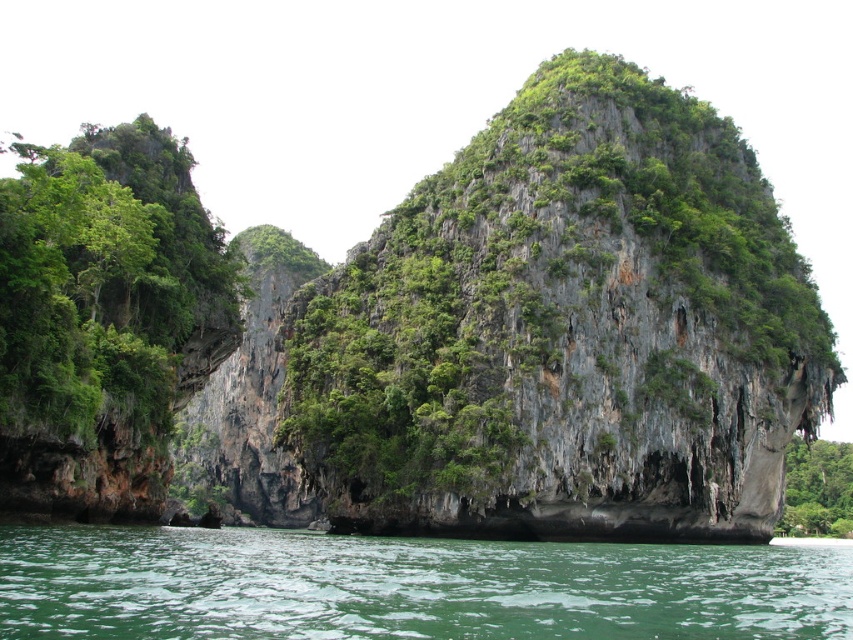
You are a hiker standing at the base of the limestone cliffs and want to take a photo of the green liquid water at lower center and the green leafy vegetation at left. Which object should you focus on first to ensure both are in the same frame?

You should focus on the green liquid water at lower center first because it is closer to you than the green leafy vegetation at left, so adjusting focus to the closer object will keep both in the frame.